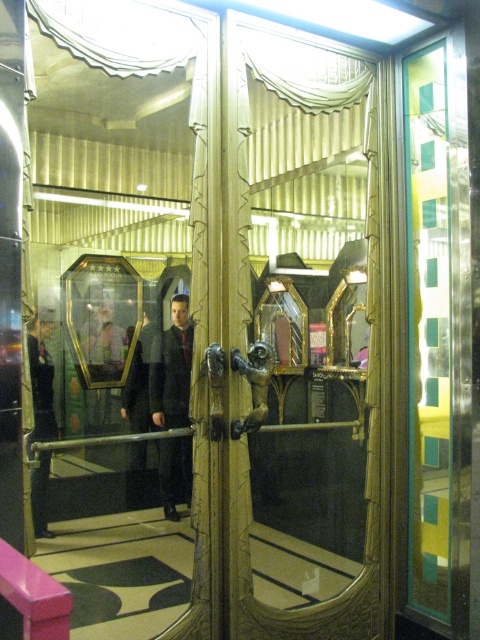
Question: Which object appears closest to the camera in this image?

Choices:
 (A) dark gray fabric jacket at center
 (B) metallic gold door at right
 (C) gold textured glass door at center

Answer: (C)

Question: Can you confirm if dark gray fabric jacket at center is thinner than black fabric uniform at left?

Choices:
 (A) no
 (B) yes

Answer: (B)

Question: Which point is farther to the camera?

Choices:
 (A) gold textured glass door at center
 (B) metallic gold door at right
 (C) dark gray fabric jacket at center

Answer: (C)

Question: Which object is the closest to the gold textured glass door at center?

Choices:
 (A) black fabric uniform at left
 (B) dark gray fabric jacket at center

Answer: (B)

Question: Is the position of metallic gold door at right more distant than that of black fabric uniform at left?

Choices:
 (A) no
 (B) yes

Answer: (A)

Question: Does metallic gold door at right appear under black fabric uniform at left?

Choices:
 (A) no
 (B) yes

Answer: (A)